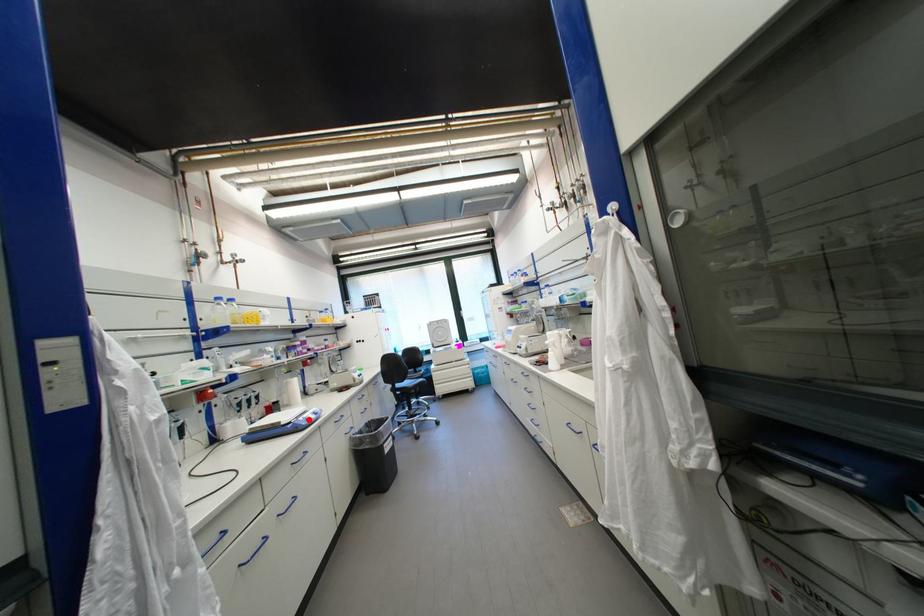
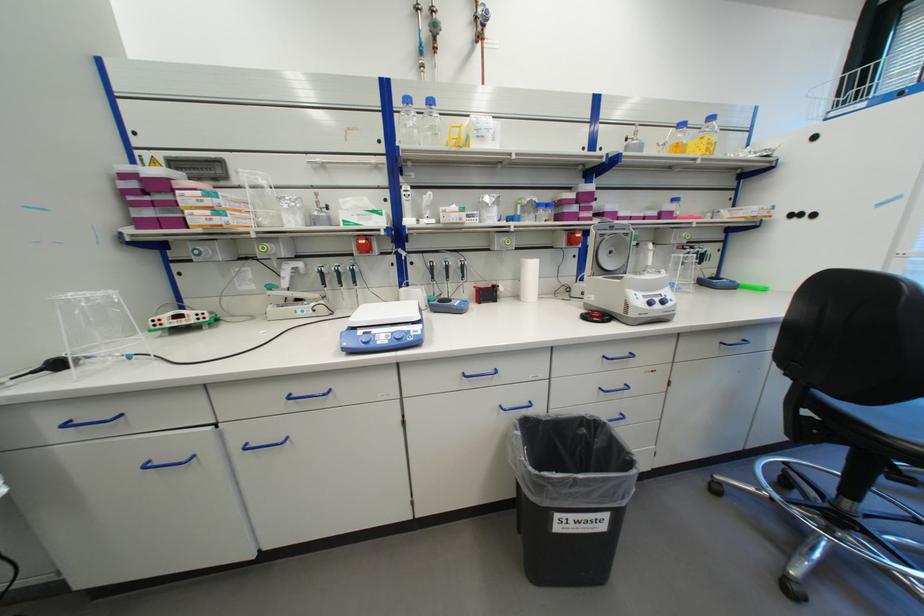
In the second image, find the point that corresponds to the highlighted location in the first image.

(369, 333)